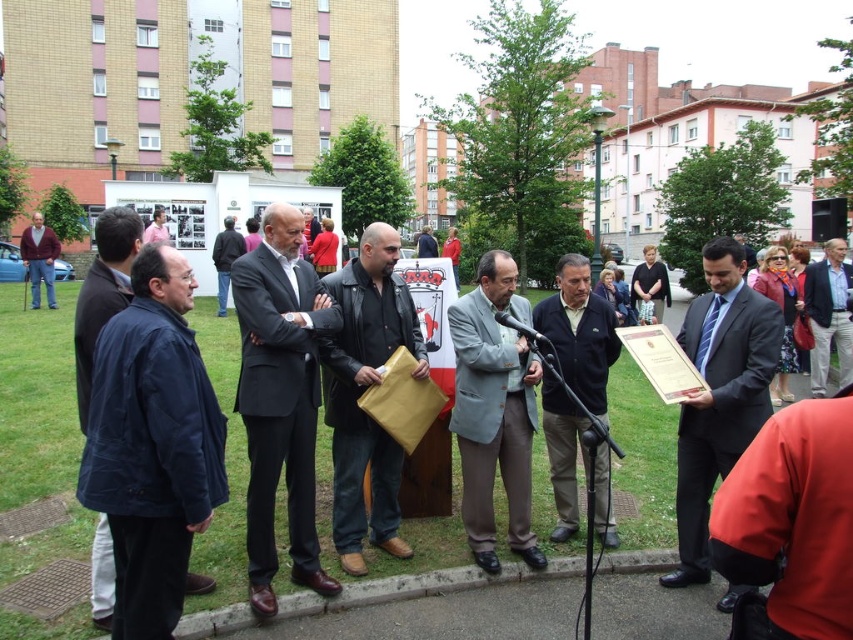
You are attending a formal event and need to locate two attendees based on their clothing. The light gray suit at center and the maroon fabric jacket at left are both present. Which of these two is positioned lower in the image?

The light gray suit at center is positioned lower than the maroon fabric jacket at left in the image.